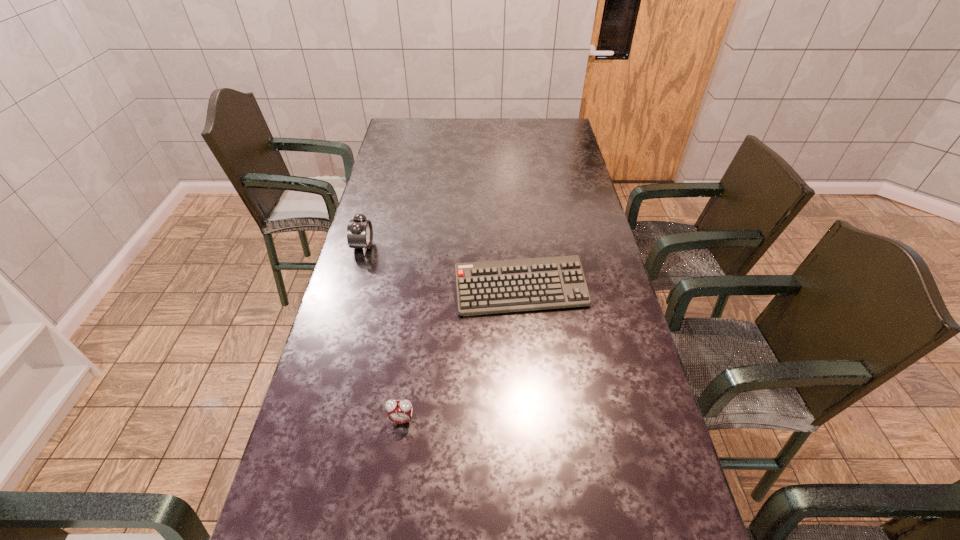
Where is `vacant space that is in between the nearest object and the left alarm clock`? vacant space that is in between the nearest object and the left alarm clock is located at coordinates (382, 333).

You are a GUI agent. You are given a task and a screenshot of the screen. Output one action in this format:
    pyautogui.click(x=<x>, y=<y>)
    Task: Click on the unoccupied position between the nearer alarm clock and the rightmost object
    This screenshot has width=960, height=540.
    Given the screenshot: What is the action you would take?
    pyautogui.click(x=461, y=355)

You are a GUI agent. You are given a task and a screenshot of the screen. Output one action in this format:
    pyautogui.click(x=<x>, y=<y>)
    Task: Click on the free spot between the computer keyboard and the second tallest object
    The width and height of the screenshot is (960, 540).
    Given the screenshot: What is the action you would take?
    pyautogui.click(x=461, y=355)

This screenshot has height=540, width=960. Identify the location of vacant region between the nearest object and the farther alarm clock. (382, 333).

Find the location of a particular element. The height and width of the screenshot is (540, 960). object that is the nearest to the leftmost object is located at coordinates (490, 287).

Identify which object is the second closest to the shortest object. Please provide its 2D coordinates. Your answer should be formatted as a tuple, i.e. [(x, y)], where the tuple contains the x and y coordinates of a point satisfying the conditions above.

[(399, 411)]

Find the location of `vacant point that satisfies the following two spatial constraints: 1. on the front side of the shortest object; 2. on the left side of the taller alarm clock`. vacant point that satisfies the following two spatial constraints: 1. on the front side of the shortest object; 2. on the left side of the taller alarm clock is located at coordinates (350, 291).

Where is `free space that satisfies the following two spatial constraints: 1. on the front side of the left alarm clock; 2. on the left side of the rightmost object`? The image size is (960, 540). free space that satisfies the following two spatial constraints: 1. on the front side of the left alarm clock; 2. on the left side of the rightmost object is located at coordinates (350, 291).

Find the location of a particular element. This screenshot has width=960, height=540. free space in the image that satisfies the following two spatial constraints: 1. on the back side of the rightmost object; 2. on the front side of the taller alarm clock is located at coordinates (516, 246).

You are a GUI agent. You are given a task and a screenshot of the screen. Output one action in this format:
    pyautogui.click(x=<x>, y=<y>)
    Task: Click on the vacant region that satisfies the following two spatial constraints: 1. on the back side of the rightmost object; 2. on the front side of the farthest object
    The height and width of the screenshot is (540, 960).
    Given the screenshot: What is the action you would take?
    pyautogui.click(x=516, y=246)